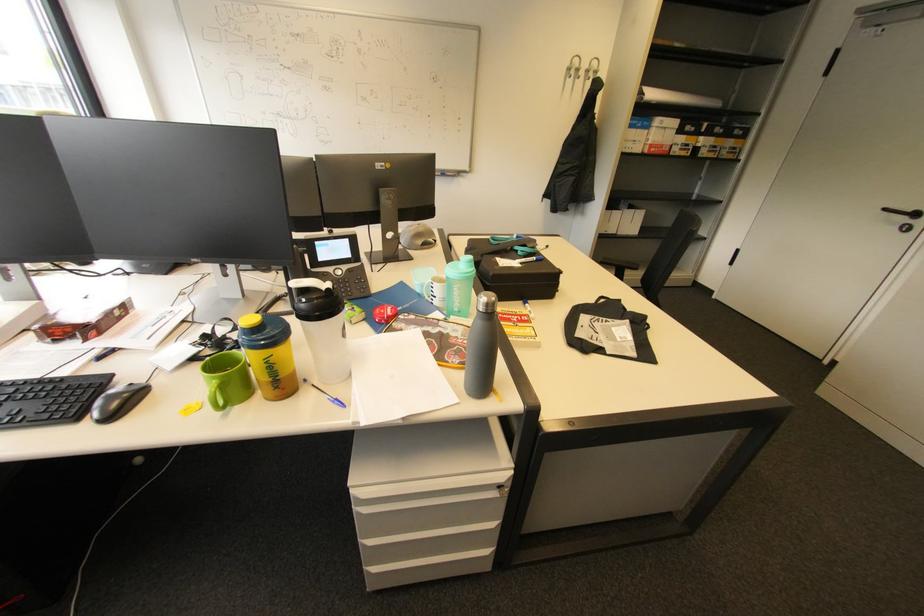
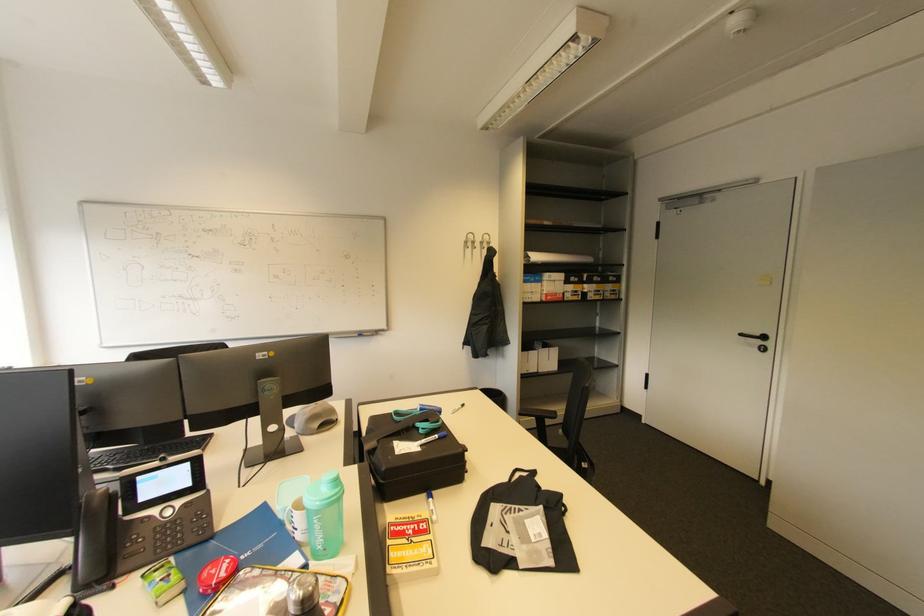
Find the pixel in the second image that matches (424,243) in the first image.

(321, 426)